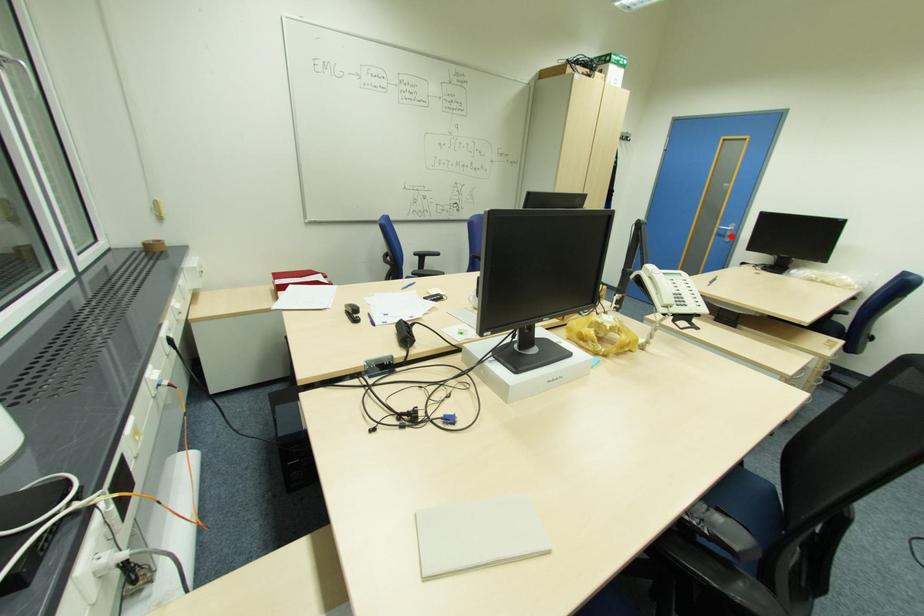
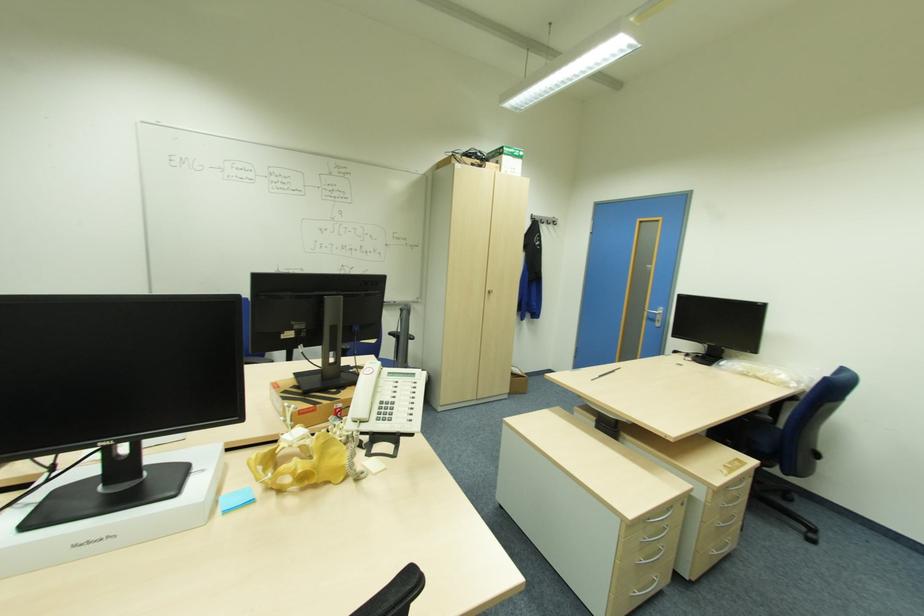
The point at the highlighted location is marked in the first image. Where is the corresponding point in the second image?

(661, 321)